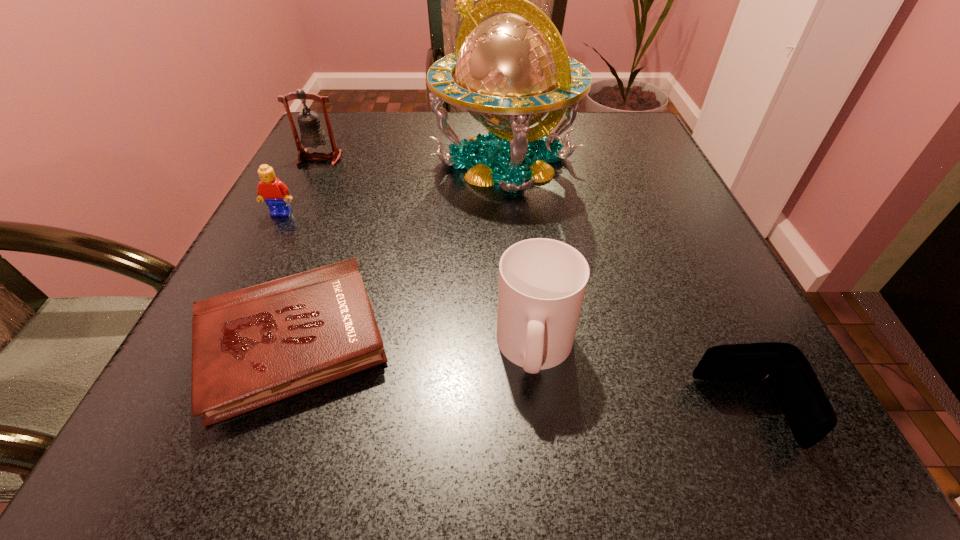
Find the location of a particular element. This screenshot has width=960, height=540. the tallest object is located at coordinates (512, 69).

At what (x,y) coordinates should I click in order to perform the action: click on bell. Please return your answer as a coordinate pair (x, y). Image resolution: width=960 pixels, height=540 pixels. Looking at the image, I should click on (312, 134).

Locate an element on the screen. This screenshot has height=540, width=960. mug is located at coordinates (542, 282).

The width and height of the screenshot is (960, 540). I want to click on the third farthest object, so click(275, 193).

In order to click on the third shortest object in this screenshot , I will do 275,193.

This screenshot has height=540, width=960. I want to click on wallet, so click(x=810, y=415).

This screenshot has width=960, height=540. Identify the location of the rightmost object. (810, 415).

I want to click on hardback book, so click(251, 347).

Find the location of a particular element. free space located on the back of the globe is located at coordinates (502, 116).

Where is `vacant area situated on the front of the bell`? vacant area situated on the front of the bell is located at coordinates (297, 206).